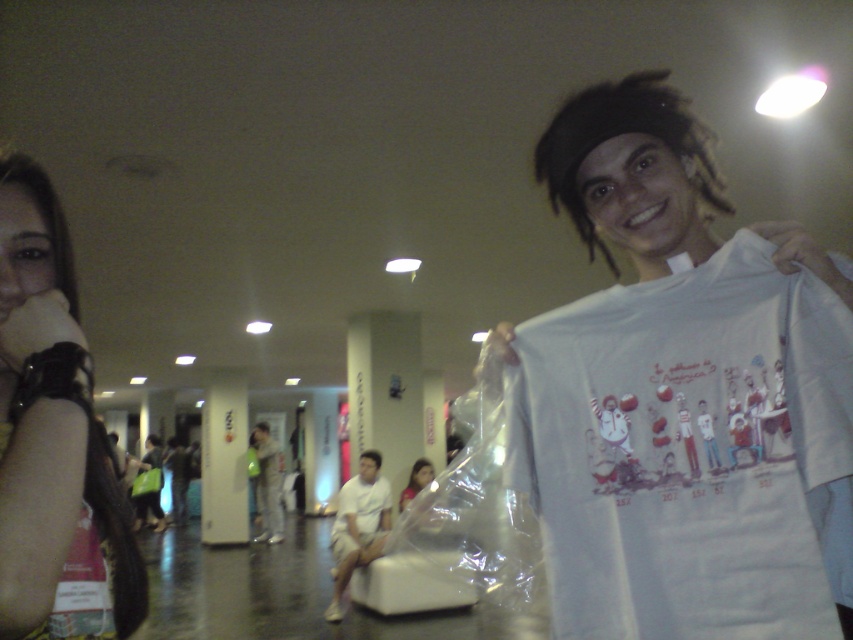
In the scene described, there is a person holding a white T shirt with a colorful graphic design and another individual marked by the point at (x=358, y=525). Which object is closer to the viewer?

The point at (x=358, y=525) marks the white cotton shirt at center, so the white cotton shirt at center is closer to the viewer than the person holding the white T shirt with a colorful graphic design in the foreground.